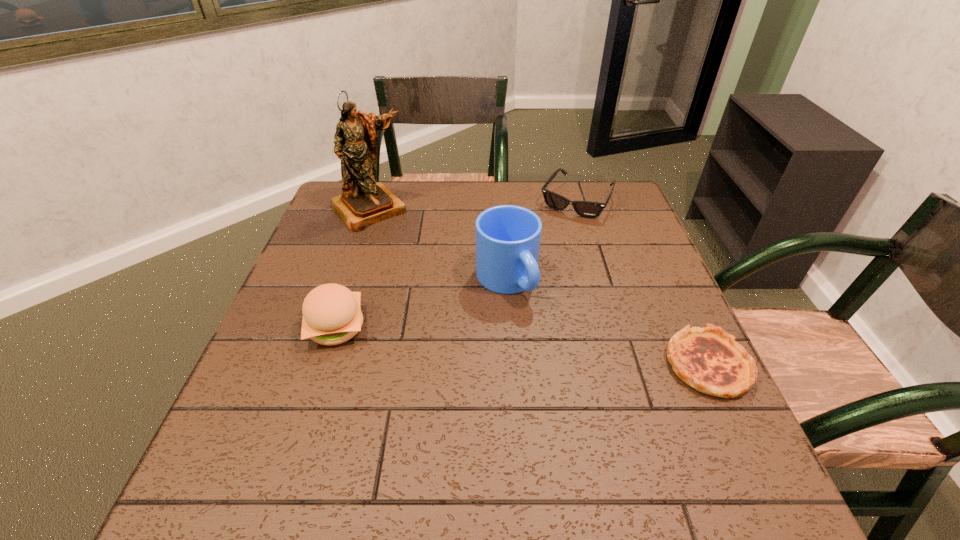
I want to click on vacant area that lies between the quiche and the second shortest object, so click(642, 282).

You are a GUI agent. You are given a task and a screenshot of the screen. Output one action in this format:
    pyautogui.click(x=<x>, y=<y>)
    Task: Click on the blank region between the third shortest object and the shortest object
    
    Given the screenshot: What is the action you would take?
    pyautogui.click(x=522, y=346)

The width and height of the screenshot is (960, 540). Identify the location of empty space that is in between the mug and the fourth tallest object. (541, 240).

You are a GUI agent. You are given a task and a screenshot of the screen. Output one action in this format:
    pyautogui.click(x=<x>, y=<y>)
    Task: Click on the empty location between the shortest object and the third shortest object
    
    Given the screenshot: What is the action you would take?
    pyautogui.click(x=522, y=346)

Where is `vacant space that is in between the quiche and the third shortest object`? vacant space that is in between the quiche and the third shortest object is located at coordinates (522, 346).

The width and height of the screenshot is (960, 540). Find the location of `vacant point located between the sunglasses and the third shortest object`. vacant point located between the sunglasses and the third shortest object is located at coordinates (456, 264).

The height and width of the screenshot is (540, 960). In order to click on empty location between the fourth tallest object and the mug in this screenshot , I will do `click(541, 240)`.

Find the location of a particular element. The image size is (960, 540). free space between the fourth tallest object and the tallest object is located at coordinates (473, 205).

Locate an element on the screen. The height and width of the screenshot is (540, 960). free space that is in between the tallest object and the quiche is located at coordinates (539, 287).

Image resolution: width=960 pixels, height=540 pixels. I want to click on object that is the third closest one to the sunglasses, so click(708, 359).